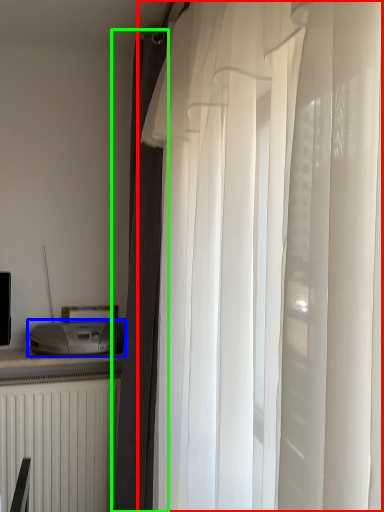
Question: Estimate the real-world distances between objects in this image. Which object is closer to curtain (highlighted by a red box), appliance (highlighted by a blue box) or curtain (highlighted by a green box)?

Choices:
 (A) appliance
 (B) curtain

Answer: (B)